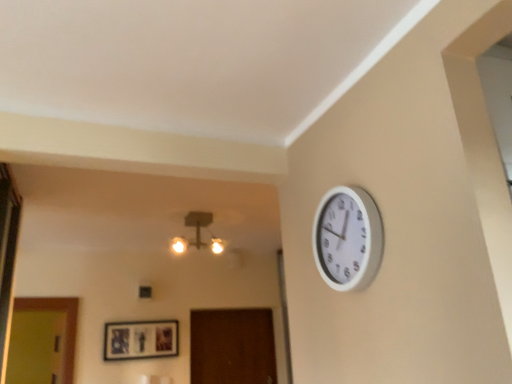
What do you see at coordinates (196, 230) in the screenshot? The image size is (512, 384). I see `matte glass chandelier at upper center` at bounding box center [196, 230].

This screenshot has width=512, height=384. What do you see at coordinates (140, 340) in the screenshot?
I see `matte black picture frame at center` at bounding box center [140, 340].

In order to click on matte glass chandelier at upper center in this screenshot , I will do `click(196, 230)`.

Is matte black picture frame at center at the left side of matte glass chandelier at upper center?

Indeed, matte black picture frame at center is positioned on the left side of matte glass chandelier at upper center.

Which of these two, matte black picture frame at center or matte glass chandelier at upper center, is wider?

Wider between the two is matte glass chandelier at upper center.

Is matte black picture frame at center inside or outside of matte glass chandelier at upper center?

matte black picture frame at center is outside matte glass chandelier at upper center.

From the image's perspective, which one is positioned higher, matte black picture frame at center or matte glass chandelier at upper center?

matte glass chandelier at upper center appears higher in the image.

Which is less distant, [324,249] or [106,333]?

Point [324,249] is closer to the camera than point [106,333].

Is white plastic wall clock at upper right smaller than matte black picture frame at center?

Indeed, white plastic wall clock at upper right has a smaller size compared to matte black picture frame at center.

In terms of width, does white plastic wall clock at upper right look wider or thinner when compared to matte black picture frame at center?

white plastic wall clock at upper right is wider than matte black picture frame at center.

Which object is thinner, matte glass chandelier at upper center or matte black picture frame at center?

matte black picture frame at center.

Considering the relative sizes of matte glass chandelier at upper center and matte black picture frame at center in the image provided, is matte glass chandelier at upper center shorter than matte black picture frame at center?

Yes.

Considering the relative positions of matte glass chandelier at upper center and matte black picture frame at center in the image provided, is matte glass chandelier at upper center to the right of matte black picture frame at center from the viewer's perspective?

Yes, matte glass chandelier at upper center is to the right of matte black picture frame at center.

In the image, is matte glass chandelier at upper center positioned in front of or behind matte black picture frame at center?

Visually, matte glass chandelier at upper center is located in front of matte black picture frame at center.

Is matte glass chandelier at upper center positioned before white plastic wall clock at upper right?

No, the depth of matte glass chandelier at upper center is greater than that of white plastic wall clock at upper right.

Is point (221, 241) closer to camera compared to point (353, 238)?

No, (221, 241) is further to viewer.

Considering the sizes of objects matte glass chandelier at upper center and white plastic wall clock at upper right in the image provided, who is thinner, matte glass chandelier at upper center or white plastic wall clock at upper right?

With smaller width is white plastic wall clock at upper right.

Is matte glass chandelier at upper center outside of white plastic wall clock at upper right?

Yes.

Does matte black picture frame at center have a greater width compared to white plastic wall clock at upper right?

No, matte black picture frame at center is not wider than white plastic wall clock at upper right.

From a real-world perspective, is matte black picture frame at center positioned over white plastic wall clock at upper right based on gravity?

No, from a real-world perspective, matte black picture frame at center is not on top of white plastic wall clock at upper right.

Locate an element on the screen. The width and height of the screenshot is (512, 384). wall clock on the right of matte black picture frame at center is located at coordinates (348, 238).

Could you tell me if matte black picture frame at center is turned towards white plastic wall clock at upper right?

Yes, matte black picture frame at center is aimed at white plastic wall clock at upper right.

Is matte glass chandelier at upper center completely or partially inside white plastic wall clock at upper right?

No, matte glass chandelier at upper center is located outside of white plastic wall clock at upper right.

Which object is thinner, white plastic wall clock at upper right or matte glass chandelier at upper center?

With smaller width is white plastic wall clock at upper right.

Which object is further away from the camera, white plastic wall clock at upper right or matte glass chandelier at upper center?

Positioned behind is matte glass chandelier at upper center.

What are the coordinates of `picture frame that is under the matte glass chandelier at upper center (from a real-world perspective)` in the screenshot? It's located at (140, 340).

The image size is (512, 384). Identify the location of picture frame to the left of white plastic wall clock at upper right. (140, 340).

Based on their spatial positions, is white plastic wall clock at upper right or matte glass chandelier at upper center closer to matte black picture frame at center?

Based on the image, matte glass chandelier at upper center appears to be nearer to matte black picture frame at center.

Looking at the image, which one is located further to matte glass chandelier at upper center, matte black picture frame at center or white plastic wall clock at upper right?

white plastic wall clock at upper right.

Estimate the real-world distances between objects in this image. Which object is further from matte black picture frame at center, matte glass chandelier at upper center or white plastic wall clock at upper right?

white plastic wall clock at upper right lies further to matte black picture frame at center than the other object.

Considering their positions, is white plastic wall clock at upper right positioned further to matte glass chandelier at upper center than matte black picture frame at center?

The object further to matte glass chandelier at upper center is white plastic wall clock at upper right.

Which object lies nearer to the anchor point white plastic wall clock at upper right, matte black picture frame at center or matte glass chandelier at upper center?

Among the two, matte glass chandelier at upper center is located nearer to white plastic wall clock at upper right.

Looking at the image, which one is located further to white plastic wall clock at upper right, matte glass chandelier at upper center or matte black picture frame at center?

The object further to white plastic wall clock at upper right is matte black picture frame at center.

Image resolution: width=512 pixels, height=384 pixels. Find the location of `lamp between white plastic wall clock at upper right and matte black picture frame at center in the front-back direction`. lamp between white plastic wall clock at upper right and matte black picture frame at center in the front-back direction is located at coordinates (196, 230).